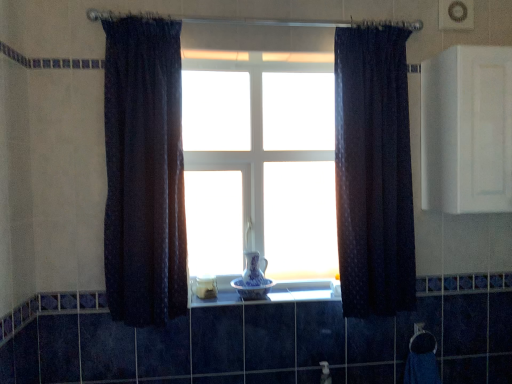
Question: Is blue porcelain vase at center, the first glass vase in the top-to-bottom sequence, positioned far away from white matte cabinet at upper right?

Choices:
 (A) yes
 (B) no

Answer: (A)

Question: Is blue porcelain vase at center, marked as the 2th glass vase in a bottom-to-top arrangement, completely or partially outside of white matte cabinet at upper right?

Choices:
 (A) no
 (B) yes

Answer: (B)

Question: Is white matte cabinet at upper right a part of blue porcelain vase at center, the first glass vase in the top-to-bottom sequence?

Choices:
 (A) no
 (B) yes

Answer: (A)

Question: Does blue porcelain vase at center, the first glass vase in the top-to-bottom sequence, have a greater width compared to white matte cabinet at upper right?

Choices:
 (A) yes
 (B) no

Answer: (B)

Question: Can you confirm if blue porcelain vase at center, the first glass vase in the top-to-bottom sequence, is smaller than white matte cabinet at upper right?

Choices:
 (A) yes
 (B) no

Answer: (A)

Question: From a real-world perspective, is blue porcelain vase at center, marked as the 2th glass vase in a bottom-to-top arrangement, below white matte cabinet at upper right?

Choices:
 (A) yes
 (B) no

Answer: (A)

Question: Can you confirm if blue porcelain vase at center, the 2th glass vase positioned from the top, is bigger than blue porcelain vase at center, marked as the 2th glass vase in a bottom-to-top arrangement?

Choices:
 (A) yes
 (B) no

Answer: (B)

Question: From the image's perspective, is blue porcelain vase at center, which ranks as the first glass vase in bottom-to-top order, located above blue porcelain vase at center, marked as the 2th glass vase in a bottom-to-top arrangement?

Choices:
 (A) no
 (B) yes

Answer: (A)

Question: Is blue porcelain vase at center, which ranks as the first glass vase in bottom-to-top order, in contact with blue porcelain vase at center, the first glass vase in the top-to-bottom sequence?

Choices:
 (A) yes
 (B) no

Answer: (A)

Question: From the image's perspective, is blue porcelain vase at center, the 2th glass vase positioned from the top, below blue porcelain vase at center, marked as the 2th glass vase in a bottom-to-top arrangement?

Choices:
 (A) no
 (B) yes

Answer: (B)

Question: Can you confirm if blue porcelain vase at center, the 2th glass vase positioned from the top, is wider than blue porcelain vase at center, the first glass vase in the top-to-bottom sequence?

Choices:
 (A) no
 (B) yes

Answer: (B)

Question: Considering the relative sizes of blue porcelain vase at center, the 2th glass vase positioned from the top, and blue porcelain vase at center, marked as the 2th glass vase in a bottom-to-top arrangement, in the image provided, is blue porcelain vase at center, the 2th glass vase positioned from the top, taller than blue porcelain vase at center, marked as the 2th glass vase in a bottom-to-top arrangement,?

Choices:
 (A) yes
 (B) no

Answer: (B)

Question: Is blue porcelain vase at center, which ranks as the first glass vase in bottom-to-top order, shorter than white matte cabinet at upper right?

Choices:
 (A) no
 (B) yes

Answer: (B)